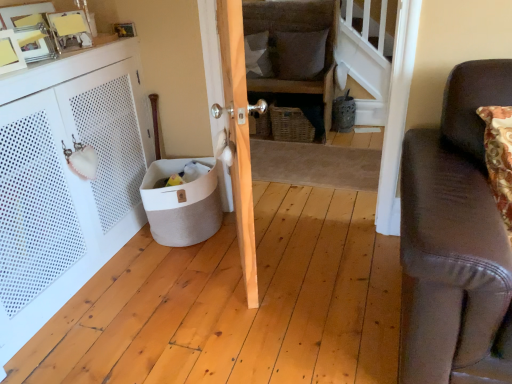
Question: Is woven brown basket at center not inside white fabric pillow at center, which is counted as the 1th pillow, starting from the right?

Choices:
 (A) yes
 (B) no

Answer: (A)

Question: From a real-world perspective, is woven brown basket at center on top of white fabric pillow at center, the 2th pillow viewed from the left?

Choices:
 (A) yes
 (B) no

Answer: (B)

Question: Are woven brown basket at center and white fabric pillow at center, the 2th pillow viewed from the left, making contact?

Choices:
 (A) yes
 (B) no

Answer: (B)

Question: Is white fabric pillow at center, the 2th pillow viewed from the left, at the back of woven brown basket at center?

Choices:
 (A) no
 (B) yes

Answer: (A)

Question: Considering the relative sizes of woven brown basket at center and white fabric pillow at center, the 2th pillow viewed from the left, in the image provided, is woven brown basket at center wider than white fabric pillow at center, the 2th pillow viewed from the left,?

Choices:
 (A) no
 (B) yes

Answer: (B)

Question: From the image's perspective, is textured gray pillow at upper center, which appears as the 1th pillow when viewed from the left, positioned above or below woven brown basket at center?

Choices:
 (A) above
 (B) below

Answer: (A)

Question: From a real-world perspective, is textured gray pillow at upper center, marked as the 2th pillow in a right-to-left arrangement, physically located above or below woven brown basket at center?

Choices:
 (A) above
 (B) below

Answer: (A)

Question: Based on their sizes in the image, would you say textured gray pillow at upper center, marked as the 2th pillow in a right-to-left arrangement, is bigger or smaller than woven brown basket at center?

Choices:
 (A) small
 (B) big

Answer: (A)

Question: Does point (249, 64) appear closer or farther from the camera than point (274, 140)?

Choices:
 (A) farther
 (B) closer

Answer: (A)

Question: From the image's perspective, relative to white fabric pillow at center, which is counted as the 1th pillow, starting from the right, is textured gray pillow at upper center, which appears as the 1th pillow when viewed from the left, above or below?

Choices:
 (A) below
 (B) above

Answer: (B)

Question: Considering the positions of point (266, 56) and point (298, 61), is point (266, 56) closer or farther from the camera than point (298, 61)?

Choices:
 (A) closer
 (B) farther

Answer: (B)

Question: In terms of height, does textured gray pillow at upper center, marked as the 2th pillow in a right-to-left arrangement, look taller or shorter compared to white fabric pillow at center, which is counted as the 1th pillow, starting from the right?

Choices:
 (A) short
 (B) tall

Answer: (B)

Question: From a real-world perspective, is textured gray pillow at upper center, marked as the 2th pillow in a right-to-left arrangement, positioned above or below white fabric pillow at center, the 2th pillow viewed from the left?

Choices:
 (A) above
 (B) below

Answer: (B)

Question: Is beige fabric basket at lower left wider or thinner than textured gray pillow at upper center, which appears as the 1th pillow when viewed from the left?

Choices:
 (A) wide
 (B) thin

Answer: (A)

Question: From their relative heights in the image, would you say beige fabric basket at lower left is taller or shorter than textured gray pillow at upper center, which appears as the 1th pillow when viewed from the left?

Choices:
 (A) short
 (B) tall

Answer: (A)